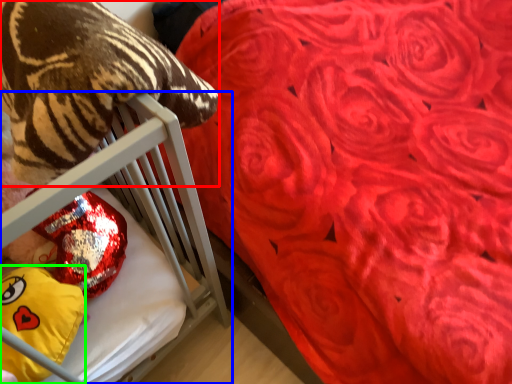
Question: Based on their relative distances, which object is nearer to animal (highlighted by a red box)? Choose from furniture (highlighted by a blue box) and throw pillow (highlighted by a green box).

Choices:
 (A) furniture
 (B) throw pillow

Answer: (A)